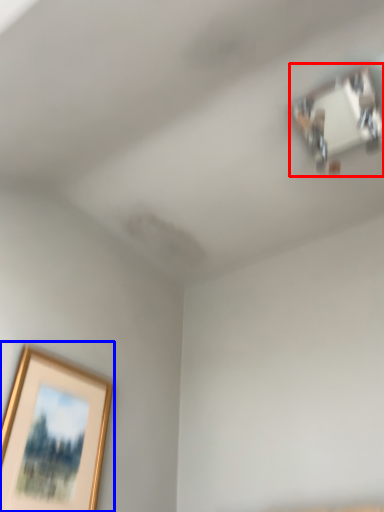
Question: Which object appears closest to the camera in this image, wide (highlighted by a red box) or picture frame (highlighted by a blue box)?

Choices:
 (A) wide
 (B) picture frame

Answer: (B)